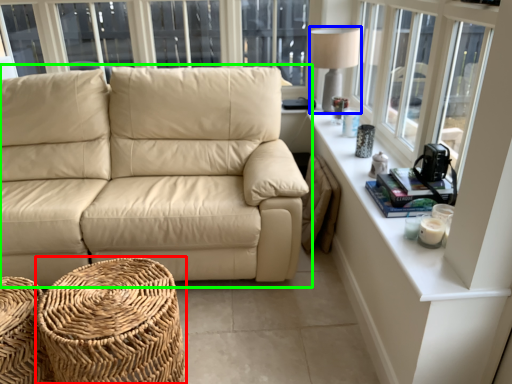
Question: Estimate the real-world distances between objects in this image. Which object is farther from footrest (highlighted by a red box), table lamp (highlighted by a blue box) or studio couch (highlighted by a green box)?

Choices:
 (A) table lamp
 (B) studio couch

Answer: (A)